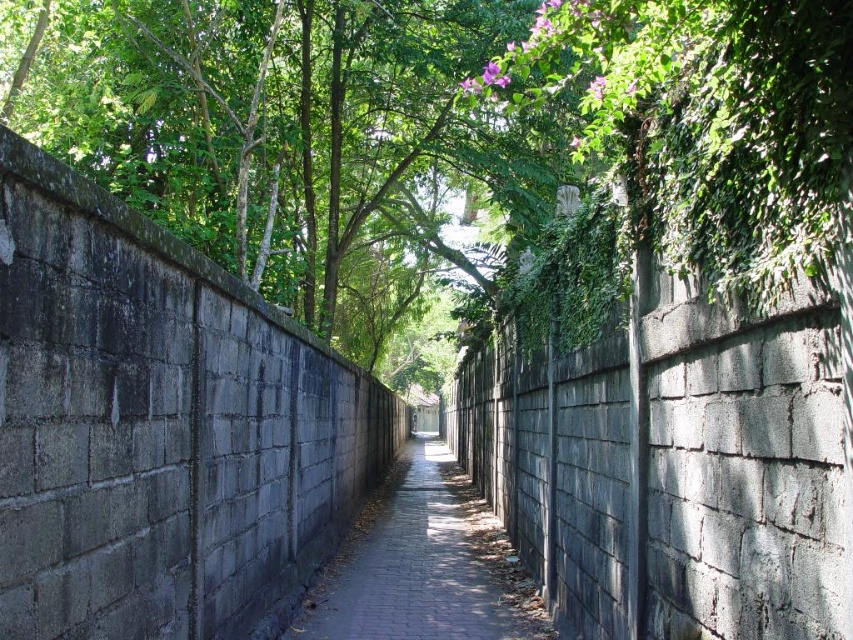
Who is higher up, green leafy tree at upper center or gray brick pavement at center?

green leafy tree at upper center

What do you see at coordinates (280, 124) in the screenshot? The width and height of the screenshot is (853, 640). I see `green leafy tree at upper center` at bounding box center [280, 124].

This screenshot has height=640, width=853. Find the location of `green leafy tree at upper center`. green leafy tree at upper center is located at coordinates (280, 124).